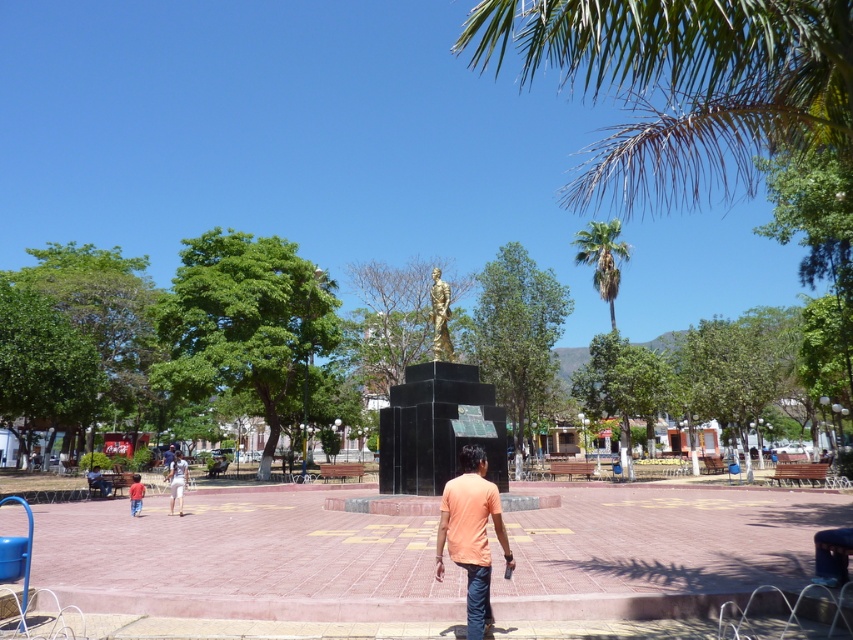
Consider the image. You are standing in the plaza and want to find the orange cotton shirt at center. According to the coordinates given, where should you look relative to the black pedestal supporting the golden statue?

The orange cotton shirt at center is located at coordinates point 0.834 on the x axis and 0.553 on the y axis relative to the black pedestal supporting the golden statue.

You are standing in the plaza and see the orange cotton shirt at center. If you want to reach it without moving your feet, can you do so with your hand?

The orange cotton shirt at center is 4.43 meters from viewer, so it is too far to reach with your hand without moving your feet.

In the scene shown: You are an observer in the plaza looking at the orange cotton shirt at center and the red cotton shirt at lower left. Which shirt is positioned higher from the ground?

The orange cotton shirt at center is positioned higher from the ground than the red cotton shirt at lower left because it is above it.